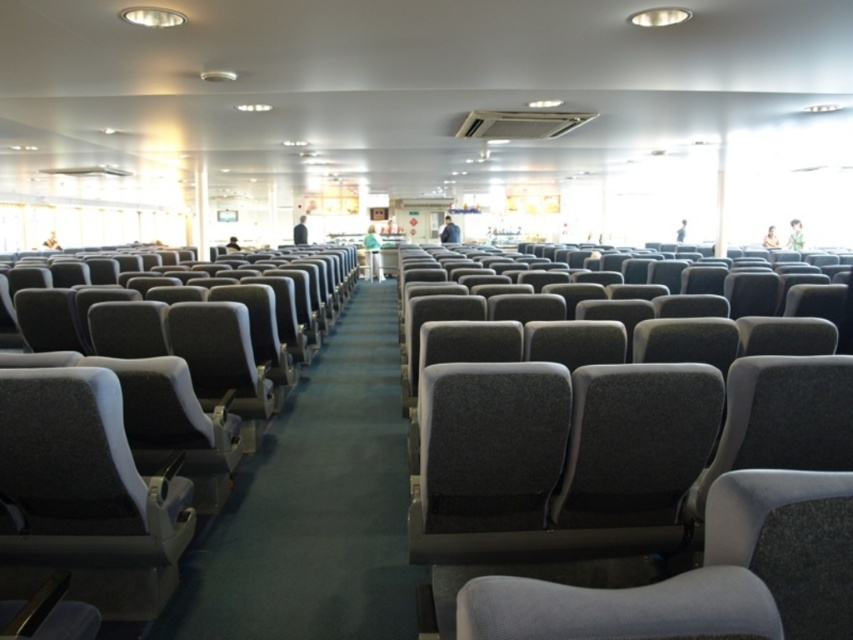
Which is behind, point (604, 436) or point (245, 280)?

The point (245, 280) is behind.

Does gray fabric seat at center have a greater width compared to gray fabric seat at left?

Indeed, gray fabric seat at center has a greater width compared to gray fabric seat at left.

Where is `gray fabric seat at center`? The height and width of the screenshot is (640, 853). gray fabric seat at center is located at coordinates (637, 497).

Identify the location of gray fabric seat at center. Image resolution: width=853 pixels, height=640 pixels. (637, 497).